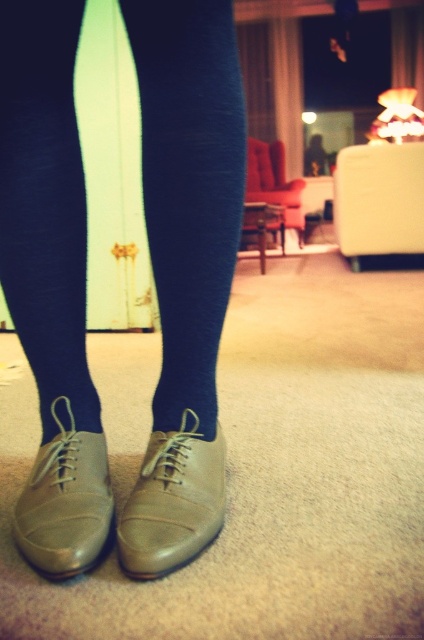
Between point (222, 76) and point (66, 477), which one is positioned behind?

Point (66, 477)

Does point (60, 205) come closer to viewer compared to point (67, 467)?

Yes, it is.

The width and height of the screenshot is (424, 640). What do you see at coordinates (189, 188) in the screenshot? I see `blue tights at center` at bounding box center [189, 188].

Where is `blue tights at center`? The height and width of the screenshot is (640, 424). blue tights at center is located at coordinates (189, 188).

Consider the image. Can you confirm if blue tights at center is taller than matte leather shoe at center?

Yes.

Describe the element at coordinates (189, 188) in the screenshot. I see `blue tights at center` at that location.

Identify the location of blue tights at center. (189, 188).

Which is in front, point (162, 552) or point (89, 442)?

Point (162, 552) is more forward.

This screenshot has width=424, height=640. In order to click on matte leather shoe at center in this screenshot , I will do `click(172, 500)`.

Does point (164, 520) come farther from viewer compared to point (72, 572)?

Yes.

Locate an element on the screen. matte leather shoe at center is located at coordinates coord(172,500).